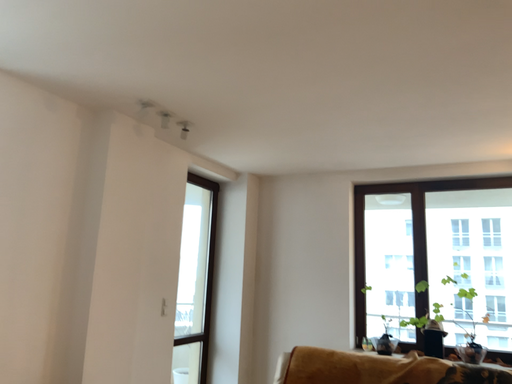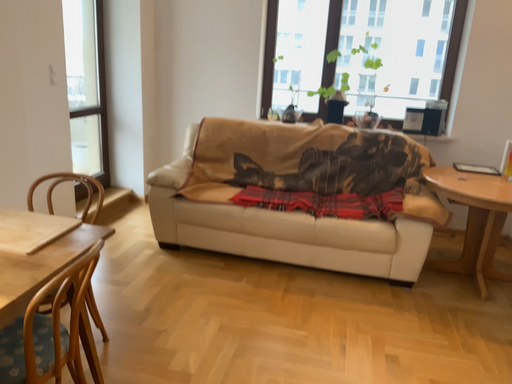
Question: Which way did the camera rotate in the video?

Choices:
 (A) rotated downward
 (B) rotated upward

Answer: (A)